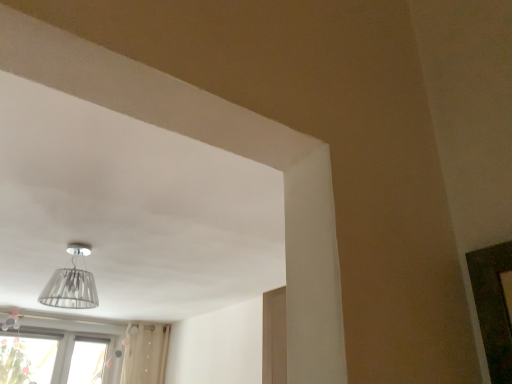
Question: Can you confirm if transparent glass lampshade at upper center is positioned to the left of transparent glass window at lower left?

Choices:
 (A) yes
 (B) no

Answer: (B)

Question: From a real-world perspective, is transparent glass lampshade at upper center physically above transparent glass window at lower left?

Choices:
 (A) yes
 (B) no

Answer: (A)

Question: Does transparent glass lampshade at upper center turn towards transparent glass window at lower left?

Choices:
 (A) yes
 (B) no

Answer: (B)

Question: Is transparent glass lampshade at upper center wider than transparent glass window at lower left?

Choices:
 (A) no
 (B) yes

Answer: (B)

Question: Can you confirm if transparent glass lampshade at upper center is smaller than transparent glass window at lower left?

Choices:
 (A) yes
 (B) no

Answer: (A)

Question: Is transparent glass lampshade at upper center looking in the opposite direction of transparent glass window at lower left?

Choices:
 (A) no
 (B) yes

Answer: (B)

Question: From the image's perspective, does transparent glass window at lower left appear higher than transparent glass lampshade at upper center?

Choices:
 (A) yes
 (B) no

Answer: (B)

Question: From a real-world perspective, is transparent glass window at lower left positioned over transparent glass lampshade at upper center based on gravity?

Choices:
 (A) no
 (B) yes

Answer: (A)

Question: Can transparent glass lampshade at upper center be found inside transparent glass window at lower left?

Choices:
 (A) yes
 (B) no

Answer: (B)

Question: Considering the relative sizes of transparent glass window at lower left and transparent glass lampshade at upper center in the image provided, is transparent glass window at lower left smaller than transparent glass lampshade at upper center?

Choices:
 (A) no
 (B) yes

Answer: (A)

Question: Does transparent glass window at lower left appear on the left side of transparent glass lampshade at upper center?

Choices:
 (A) no
 (B) yes

Answer: (B)

Question: Is transparent glass window at lower left outside of transparent glass lampshade at upper center?

Choices:
 (A) no
 (B) yes

Answer: (B)

Question: Is transparent glass window at lower left in front of or behind transparent glass lampshade at upper center in the image?

Choices:
 (A) behind
 (B) front

Answer: (A)